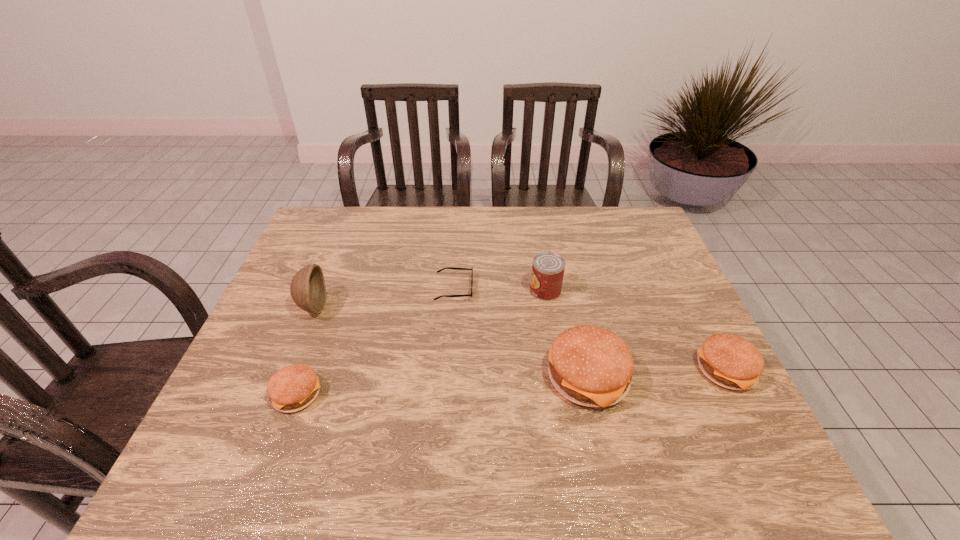
Where is `blank space that satisfies the following two spatial constraints: 1. on the front-facing side of the third object from left to right; 2. on the left side of the second shortest hamburger`? The height and width of the screenshot is (540, 960). blank space that satisfies the following two spatial constraints: 1. on the front-facing side of the third object from left to right; 2. on the left side of the second shortest hamburger is located at coordinates (448, 370).

Locate an element on the screen. free space that satisfies the following two spatial constraints: 1. on the front side of the leftmost hamburger; 2. on the left side of the tallest object is located at coordinates (277, 394).

Locate an element on the screen. free point that satisfies the following two spatial constraints: 1. on the front-facing side of the second hamburger from left to right; 2. on the left side of the third object from left to right is located at coordinates (448, 378).

Where is `vacant space that satisfies the following two spatial constraints: 1. on the back side of the leftmost hamburger; 2. on the left side of the can`? The height and width of the screenshot is (540, 960). vacant space that satisfies the following two spatial constraints: 1. on the back side of the leftmost hamburger; 2. on the left side of the can is located at coordinates (335, 291).